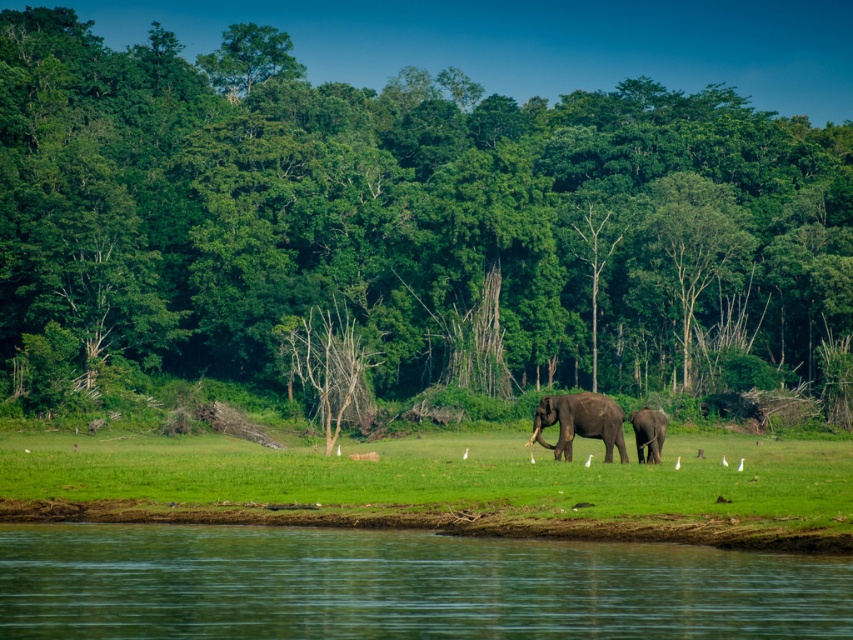
You are a bird flying over the serene natural scene. You want to land on the green leafy tree at center. Is the brown textured elephant at center blocking your path directly below you?

The green leafy tree at center is above the brown textured elephant at center, so the elephant is directly below the tree. Therefore, the brown textured elephant at center is blocking your path directly below the green leafy tree at center.